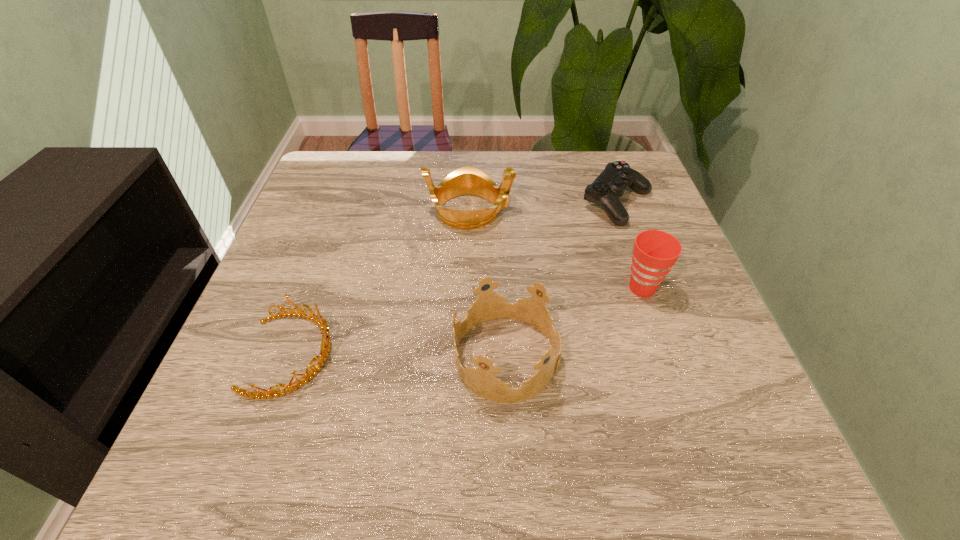
This screenshot has height=540, width=960. What are the coordinates of `the farthest tiara` in the screenshot? It's located at (467, 180).

The width and height of the screenshot is (960, 540). Find the location of `cup`. cup is located at coordinates (655, 252).

This screenshot has height=540, width=960. I want to click on control, so click(606, 189).

The image size is (960, 540). Identify the location of the shortest tiara. (321, 322).

The image size is (960, 540). I want to click on the leftmost object, so click(x=321, y=322).

The height and width of the screenshot is (540, 960). Find the location of `free space located 0.170m at the front emblem of the farthest tiara`. free space located 0.170m at the front emblem of the farthest tiara is located at coordinates (581, 211).

You are a GUI agent. You are given a task and a screenshot of the screen. Output one action in this format:
    pyautogui.click(x=<x>, y=<y>)
    Task: Click on the free space located 0.390m on the back of the third nearest object
    The image size is (960, 540).
    Given the screenshot: What is the action you would take?
    pyautogui.click(x=603, y=174)

Where is `vacant area situated 0.090m on the front of the control`? The image size is (960, 540). vacant area situated 0.090m on the front of the control is located at coordinates (636, 255).

I want to click on vacant area situated 0.080m on the front-facing side of the leftmost object, so click(x=377, y=354).

Image resolution: width=960 pixels, height=540 pixels. Identify the location of tiara that is at the far edge. (467, 180).